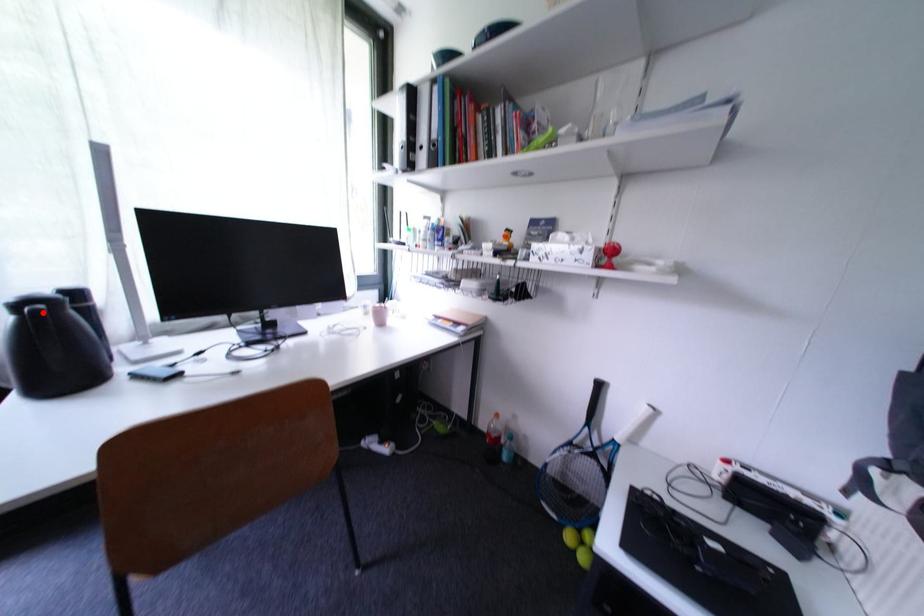
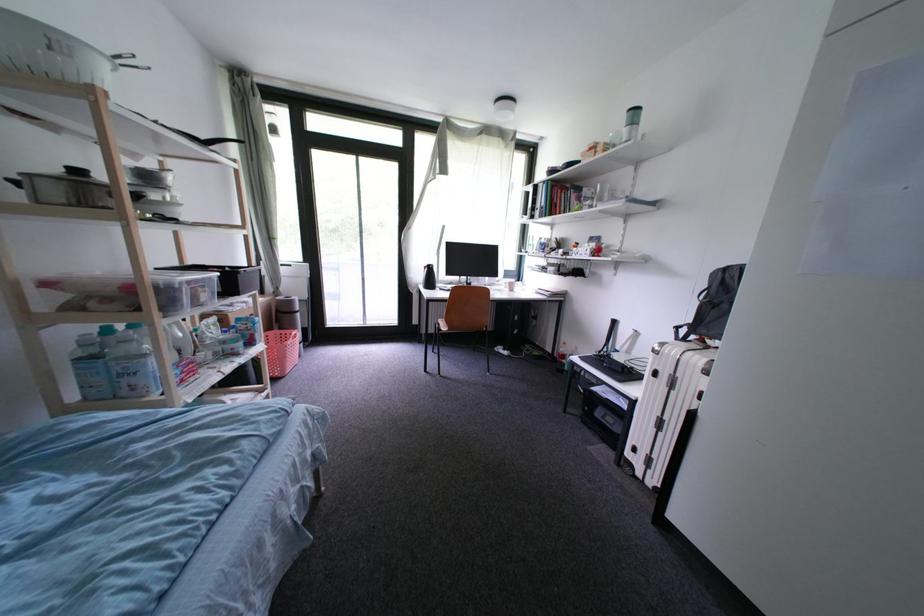
Locate, in the second image, the point that corresponds to the highlighted location in the first image.

(439, 270)